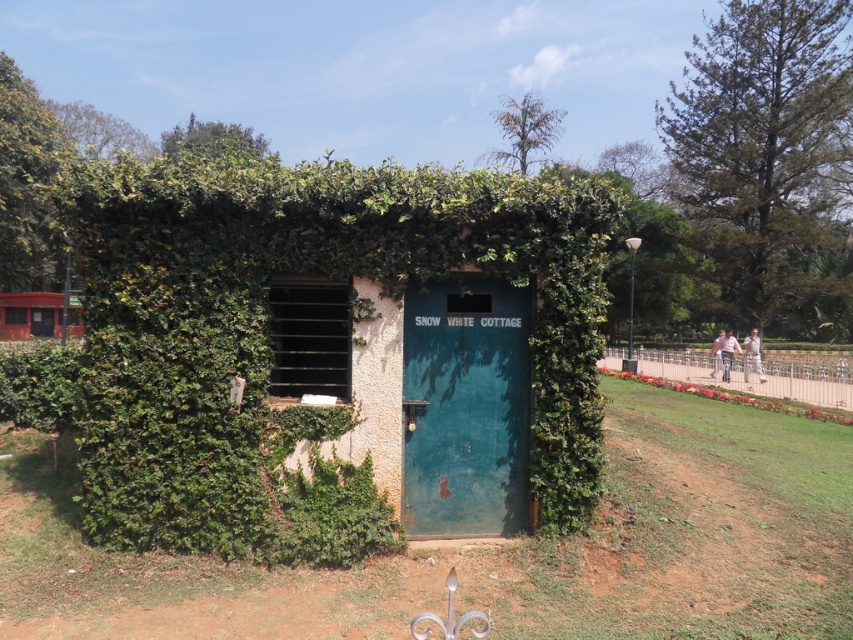
Question: Can you confirm if green textured door at center is positioned below teal matte door at center?

Choices:
 (A) yes
 (B) no

Answer: (A)

Question: Which object appears farthest from the camera in this image?

Choices:
 (A) green textured door at center
 (B) orange painted wooden signboard at left

Answer: (B)

Question: Which object is positioned closest to the orange painted wooden signboard at left?

Choices:
 (A) teal matte door at center
 (B) green textured door at center

Answer: (A)

Question: Does green textured door at center appear on the left side of orange painted wooden signboard at left?

Choices:
 (A) yes
 (B) no

Answer: (B)

Question: Which of the following is the farthest from the observer?

Choices:
 (A) (520, 289)
 (B) (62, 296)

Answer: (B)

Question: Does green textured door at center have a larger size compared to teal matte door at center?

Choices:
 (A) no
 (B) yes

Answer: (A)